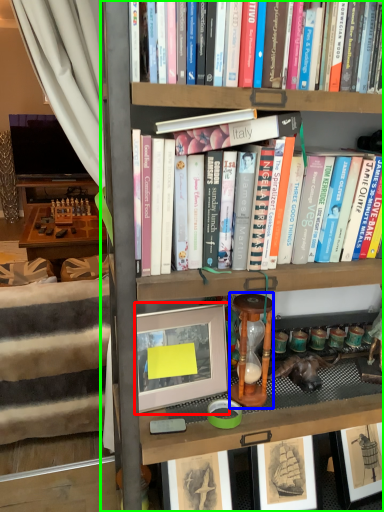
Question: Estimate the real-world distances between objects in this image. Which object is farther from picture frame (highlighted by a red box), stool (highlighted by a blue box) or bookcase (highlighted by a green box)?

Choices:
 (A) stool
 (B) bookcase

Answer: (B)